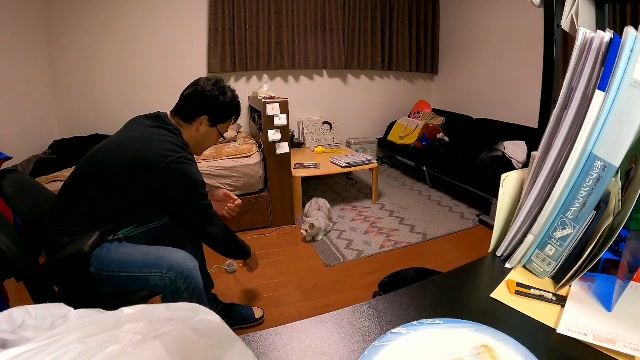
The width and height of the screenshot is (640, 360). In order to click on white plate in this screenshot , I will do `click(436, 341)`.